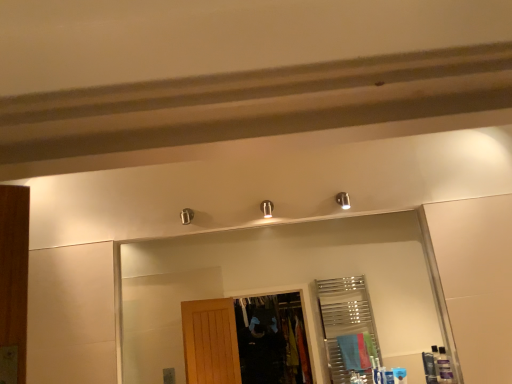
Question: From the image's perspective, is clear glass mirror at upper center positioned above or below matte black toiletry at lower right, arranged as the 2th toiletry when viewed from the right?

Choices:
 (A) above
 (B) below

Answer: (A)

Question: In the image, is clear glass mirror at upper center positioned in front of or behind matte black toiletry at lower right, arranged as the 2th toiletry when viewed from the right?

Choices:
 (A) front
 (B) behind

Answer: (A)

Question: Which of these objects is positioned closest to the blue plastic toiletry at lower right, the 1th toiletry viewed from the left?

Choices:
 (A) clear glass mirror at upper center
 (B) matte black toiletry at lower right, which is the second toiletry from left to right
 (C) translucent plastic bottles at lower right, the 1th toiletry in the right-to-left sequence

Answer: (B)

Question: Estimate the real-world distances between objects in this image. Which object is closer to the blue plastic toiletry at lower right, the 1th toiletry viewed from the left?

Choices:
 (A) clear glass mirror at upper center
 (B) matte black toiletry at lower right, arranged as the 2th toiletry when viewed from the right
 (C) translucent plastic bottles at lower right, the 1th toiletry in the right-to-left sequence

Answer: (B)